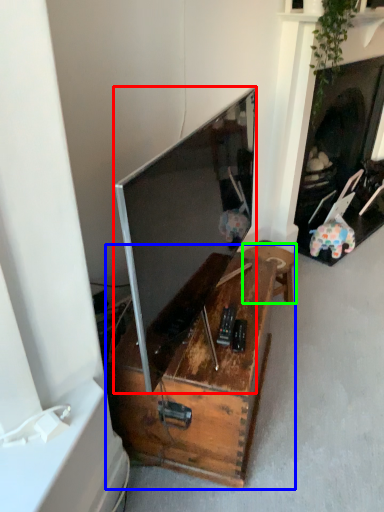
Question: Based on their relative distances, which object is farther from television (highlighted by a red box)? Choose from table (highlighted by a blue box) and furniture (highlighted by a green box).

Choices:
 (A) table
 (B) furniture

Answer: (B)